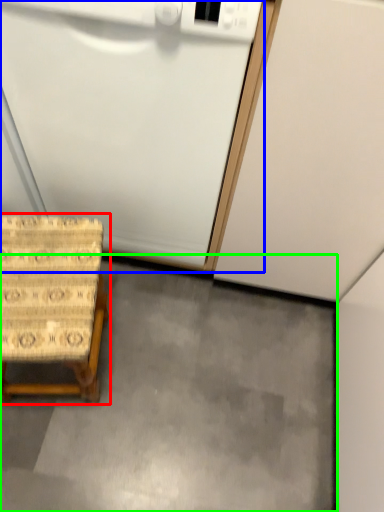
Question: Estimate the real-world distances between objects in this image. Which object is farther from furniture (highlighted by a red box), appliance (highlighted by a blue box) or concrete (highlighted by a green box)?

Choices:
 (A) appliance
 (B) concrete

Answer: (B)